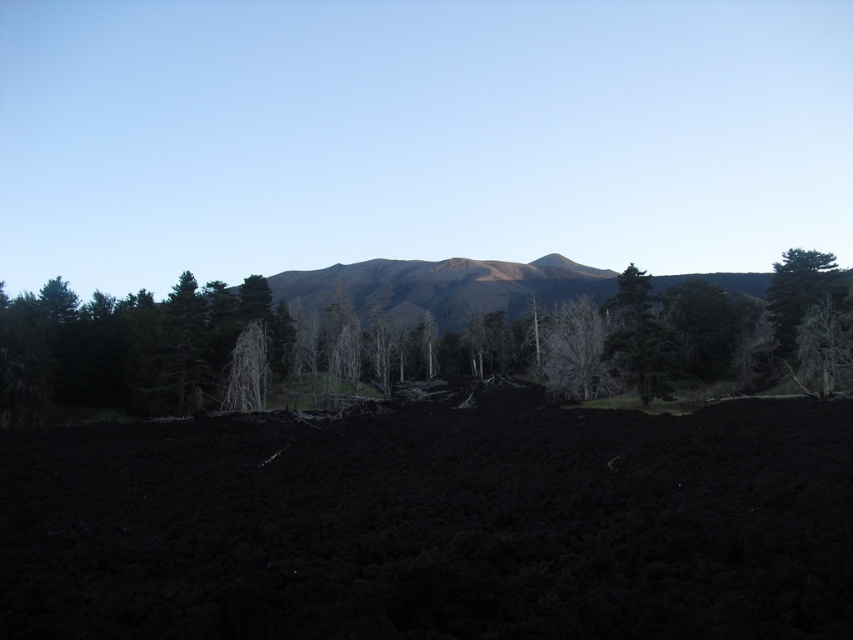
Consider the image. You are standing at the edge of the volcanic ash field and see the white matte tree at center and the green textured tree at right. Which tree is closer to you?

The white matte tree at center is closer to you because the green textured tree at right is behind it.

You are a hiker trying to navigate through the volcanic ash field. You see the dark green textured trees at center and the white matte tree at center. Which tree is closer to you?

The dark green textured trees at center is positioned over the white matte tree at center, so the dark green textured trees at center is closer to you.